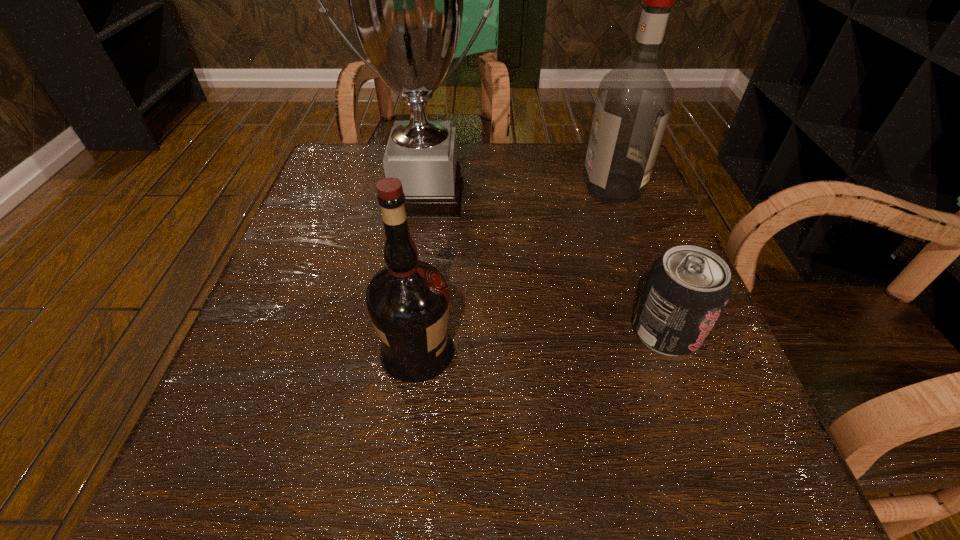
In order to click on vacant space in between the third tallest object and the taller liquor in this screenshot , I will do `click(515, 270)`.

Image resolution: width=960 pixels, height=540 pixels. What are the coordinates of `free point between the second tallest object and the trophy cup` in the screenshot? It's located at [518, 192].

Locate an element on the screen. The width and height of the screenshot is (960, 540). vacant point located between the third shortest object and the second shortest object is located at coordinates (515, 270).

You are a GUI agent. You are given a task and a screenshot of the screen. Output one action in this format:
    pyautogui.click(x=<x>, y=<y>)
    Task: Click on the free space between the shortest object and the right liquor
    The height and width of the screenshot is (540, 960).
    Given the screenshot: What is the action you would take?
    pyautogui.click(x=638, y=260)

Identify which object is located as the third nearest to the tallest object. Please provide its 2D coordinates. Your answer should be formatted as a tuple, i.e. [(x, y)], where the tuple contains the x and y coordinates of a point satisfying the conditions above.

[(686, 290)]

Identify the location of the closest object to the shorter liquor. (405, 0).

Find the location of a particular element. Image resolution: width=960 pixels, height=540 pixels. free spot that satisfies the following two spatial constraints: 1. at the front view of the trophy cup; 2. on the left side of the soda can is located at coordinates (406, 332).

The width and height of the screenshot is (960, 540). Identify the location of free space that satisfies the following two spatial constraints: 1. on the front side of the soda can; 2. on the surface of the third tallest object. [673, 352].

Where is `free location that satisfies the following two spatial constraints: 1. on the back side of the soda can; 2. on the front-facing side of the right liquor`? The width and height of the screenshot is (960, 540). free location that satisfies the following two spatial constraints: 1. on the back side of the soda can; 2. on the front-facing side of the right liquor is located at coordinates (613, 187).

You are a GUI agent. You are given a task and a screenshot of the screen. Output one action in this format:
    pyautogui.click(x=<x>, y=<y>)
    Task: Click on the vacant space that satisfies the following two spatial constraints: 1. on the front-facing side of the soda can; 2. on the left side of the third shortest object
    Image resolution: width=960 pixels, height=540 pixels.
    Given the screenshot: What is the action you would take?
    (x=664, y=332)